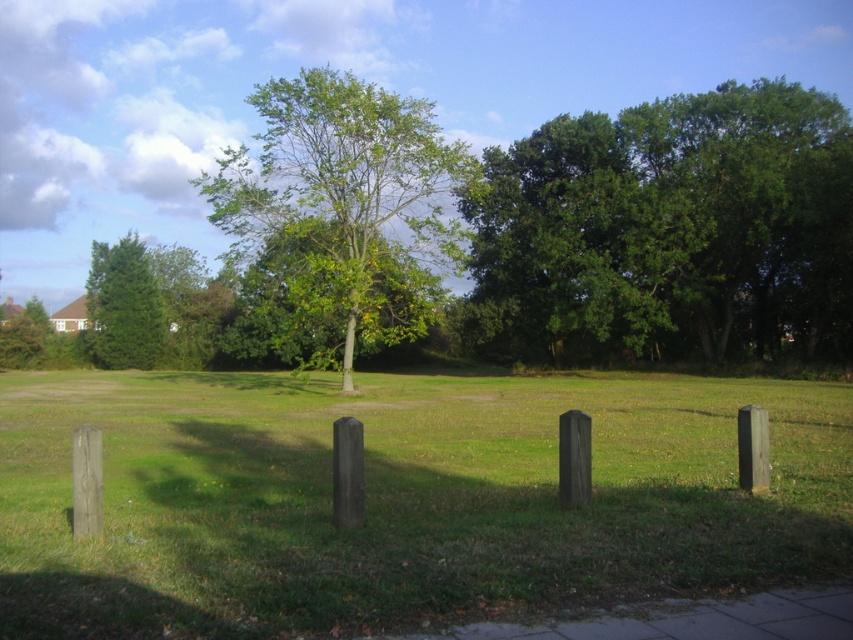
From the picture: You are planning to plant a new tree in this park. The green leafy tree at upper right and the green leafy tree at center are already present. Which existing tree should you consider for spacing if you want to ensure the new tree has enough vertical space to grow tall?

The green leafy tree at center is taller than the green leafy tree at upper right, so you should consider the green leafy tree at center for spacing to ensure the new tree has enough vertical space to grow tall.

You are planning to place a small garden bench between the wooden posts at center and the green leafy tree at upper right. Considering their sizes, which object would allow more space for the bench to be placed next to it?

The wooden posts at center have a larger width than the green leafy tree at upper right, so placing the bench next to the wooden posts at center would provide more space.